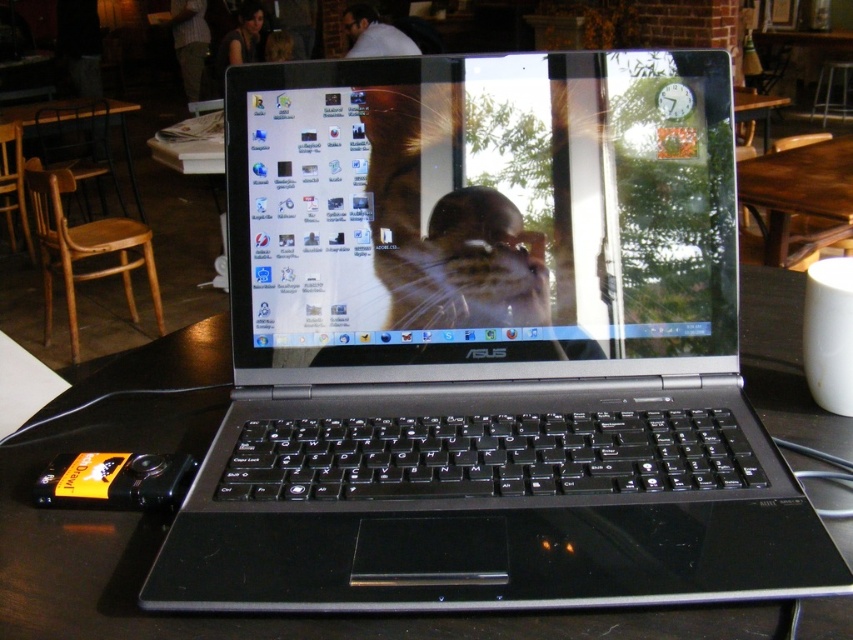
You are a delivery robot that needs to place a small package on the table. The package must be placed at point (445, 456). You can only reach areas within 50 centimeters. Can you place the package there?

The distance of point (445, 456) from camera is 49.37 centimeters, so yes, the robot can place the package there since it is within the 50 cm reach limit.

You are a delivery person who needs to place a small package on the table without touching the black plastic laptop at center. The package is 12 inches wide. Can you safely place it next to the laptop without overlapping?

The distance between the black plastic laptop at center and the camera is 14.74 inches. Since the package is 12 inches wide, you can safely place it next to the laptop as the distance allows enough space without overlapping.